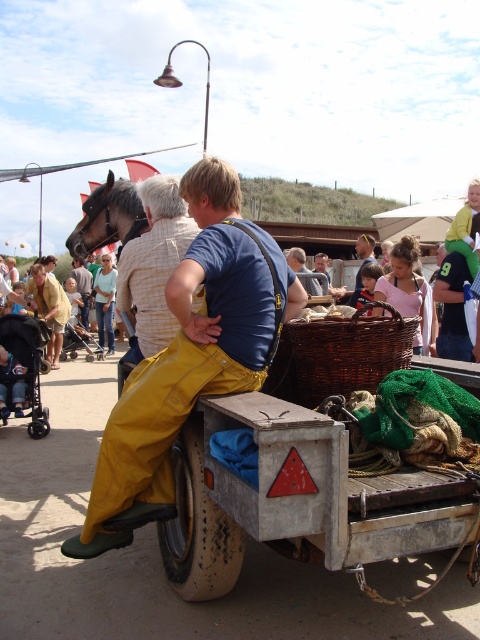
Looking at this image, you are standing at the origin point in the image. Where is the yellow canvas overalls at center located in terms of coordinates?

The yellow canvas overalls at center is located at coordinates point [191,355].